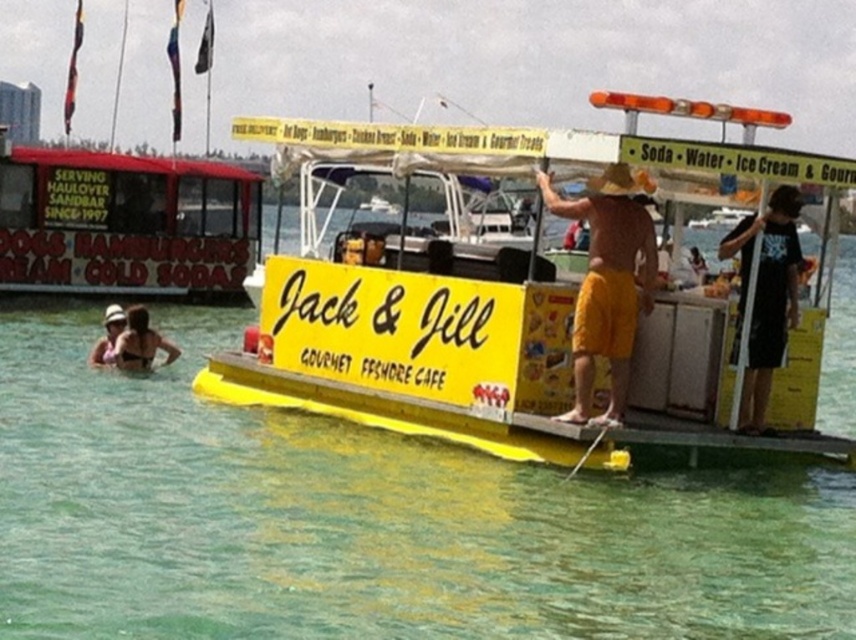
Between orange cotton shorts at center and matte white hat at upper left, which one appears on the right side from the viewer's perspective?

Positioned to the right is orange cotton shorts at center.

Between orange cotton shorts at center and matte white hat at upper left, which one has more height?

With more height is orange cotton shorts at center.

Between point (593, 284) and point (97, 340), which one is positioned behind?

The point (97, 340) is more distant.

Identify the location of orange cotton shorts at center. (605, 285).

Can you confirm if red plastic food cart at left is wider than orange cotton shorts at center?

Correct, the width of red plastic food cart at left exceeds that of orange cotton shorts at center.

Can you confirm if red plastic food cart at left is positioned above orange cotton shorts at center?

Indeed, red plastic food cart at left is positioned over orange cotton shorts at center.

Where is `red plastic food cart at left`? red plastic food cart at left is located at coordinates (123, 221).

Between clear water at center and yellow plastic boat at center, which one is positioned lower?

clear water at center is below.

This screenshot has height=640, width=856. Identify the location of clear water at center. (367, 518).